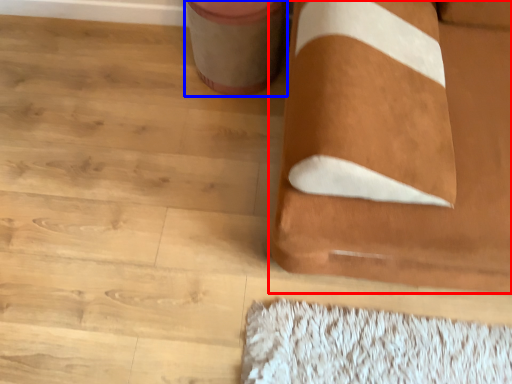
Question: Which of the following is the farthest to the observer, furniture (highlighted by a red box) or potty (highlighted by a blue box)?

Choices:
 (A) furniture
 (B) potty

Answer: (B)